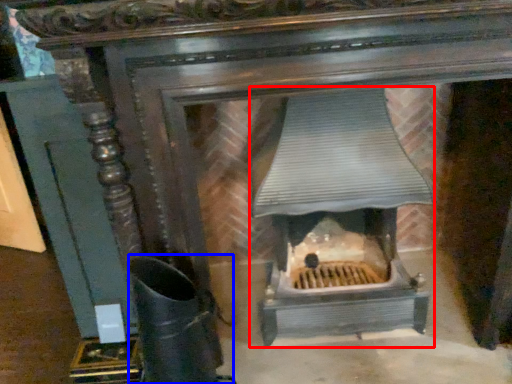
Question: Which of the following is the farthest to the observer, heater (highlighted by a red box) or boot (highlighted by a blue box)?

Choices:
 (A) heater
 (B) boot

Answer: (A)